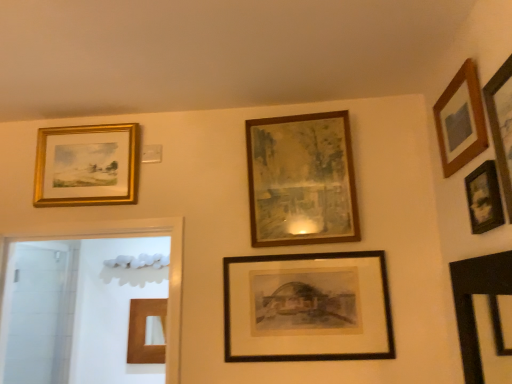
Question: Considering the relative sizes of wooden photo frame at upper right, which ranks as the fifth picture frame in left-to-right order, and wooden frame at center, placed as the fifth picture frame when sorted from right to left, in the image provided, is wooden photo frame at upper right, which ranks as the fifth picture frame in left-to-right order, thinner than wooden frame at center, placed as the fifth picture frame when sorted from right to left,?

Choices:
 (A) no
 (B) yes

Answer: (B)

Question: Is wooden photo frame at upper right, the second picture frame when ordered from right to left, wider than wooden frame at center, placed as the fifth picture frame when sorted from right to left?

Choices:
 (A) yes
 (B) no

Answer: (B)

Question: Is wooden frame at center, the second picture frame when ordered from left to right, at the back of wooden photo frame at upper right, which ranks as the fifth picture frame in left-to-right order?

Choices:
 (A) no
 (B) yes

Answer: (A)

Question: Is wooden photo frame at upper right, the second picture frame when ordered from right to left, in contact with wooden frame at center, placed as the fifth picture frame when sorted from right to left?

Choices:
 (A) no
 (B) yes

Answer: (A)

Question: Considering the relative positions of wooden photo frame at upper right, which ranks as the fifth picture frame in left-to-right order, and wooden frame at center, placed as the fifth picture frame when sorted from right to left, in the image provided, is wooden photo frame at upper right, which ranks as the fifth picture frame in left-to-right order, to the left of wooden frame at center, placed as the fifth picture frame when sorted from right to left, from the viewer's perspective?

Choices:
 (A) no
 (B) yes

Answer: (A)

Question: Could you tell me if wooden photo frame at upper right, which ranks as the fifth picture frame in left-to-right order, is facing wooden frame at center, the second picture frame when ordered from left to right?

Choices:
 (A) yes
 (B) no

Answer: (B)

Question: Does wooden picture frame at upper right, which is the 6th picture frame in left-to-right order, come in front of gold/gilded picture frame at upper left, the 1th picture frame from the left?

Choices:
 (A) no
 (B) yes

Answer: (B)

Question: Is gold/gilded picture frame at upper left, which is counted as the sixth picture frame, starting from the right, surrounded by wooden picture frame at upper right, which is the 6th picture frame in left-to-right order?

Choices:
 (A) no
 (B) yes

Answer: (A)

Question: From a real-world perspective, is wooden picture frame at upper right, placed as the first picture frame when sorted from right to left, physically above gold/gilded picture frame at upper left, which is counted as the sixth picture frame, starting from the right?

Choices:
 (A) no
 (B) yes

Answer: (A)

Question: From the image's perspective, does wooden picture frame at upper right, placed as the first picture frame when sorted from right to left, appear higher than gold/gilded picture frame at upper left, which is counted as the sixth picture frame, starting from the right?

Choices:
 (A) no
 (B) yes

Answer: (B)

Question: Is wooden picture frame at upper right, placed as the first picture frame when sorted from right to left, looking in the opposite direction of gold/gilded picture frame at upper left, the 1th picture frame from the left?

Choices:
 (A) no
 (B) yes

Answer: (A)

Question: Can you confirm if wooden picture frame at upper right, which is the 6th picture frame in left-to-right order, is positioned to the right of wooden picture frame at upper right, positioned as the 3th picture frame in right-to-left order?

Choices:
 (A) no
 (B) yes

Answer: (B)